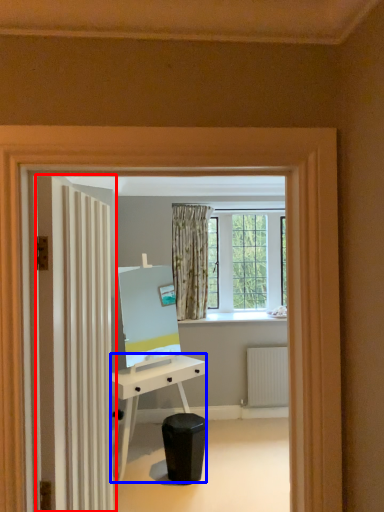
Question: Which object is closer to the camera taking this photo, door (highlighted by a red box) or desk (highlighted by a blue box)?

Choices:
 (A) door
 (B) desk

Answer: (A)